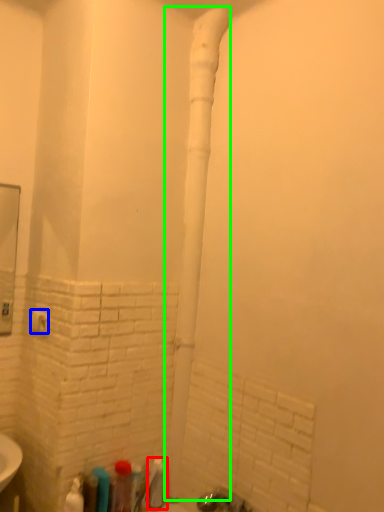
Question: Which is farther away from toiletry (highlighted by a red box)? towel bar (highlighted by a blue box) or water pipe (highlighted by a green box)?

Choices:
 (A) towel bar
 (B) water pipe

Answer: (A)